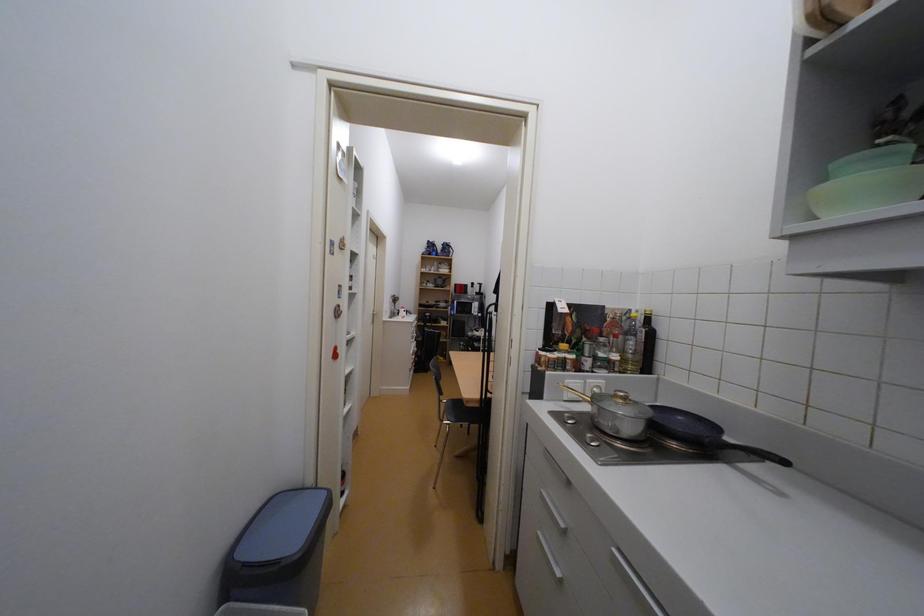
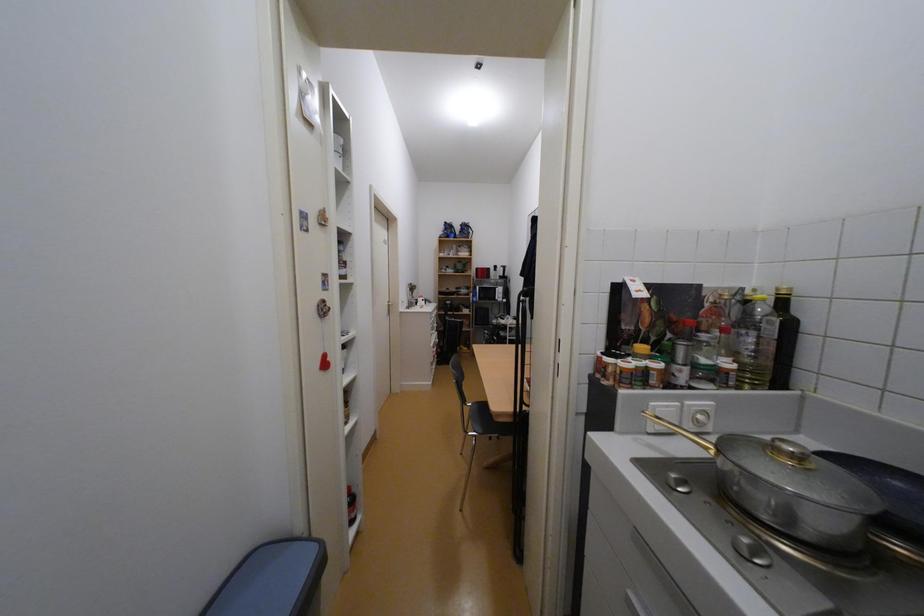
Question: Based on the continuous images, in which direction is the camera rotating? Reply with the corresponding letter.

Choices:
 (A) Left
 (B) Right
 (C) Up
 (D) Down

Answer: (A)